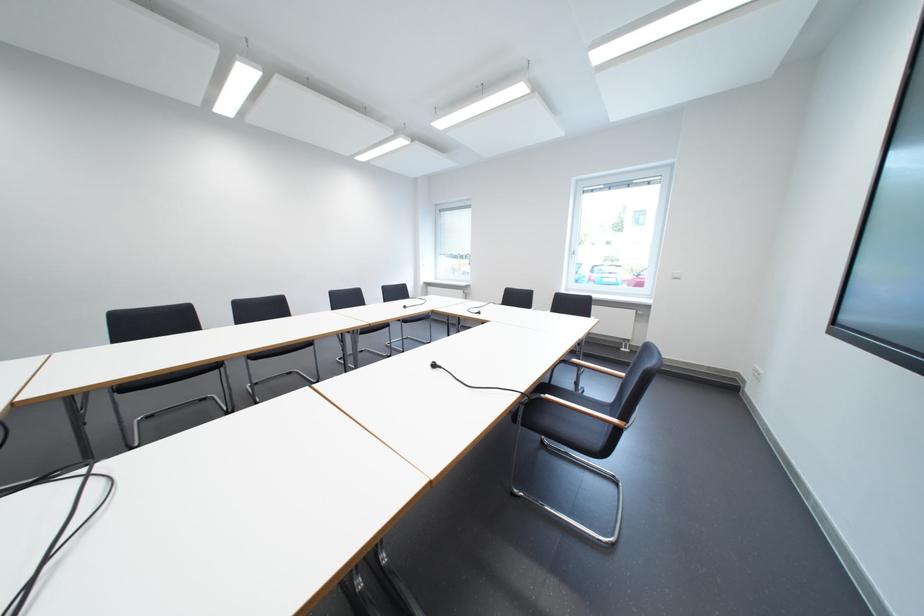
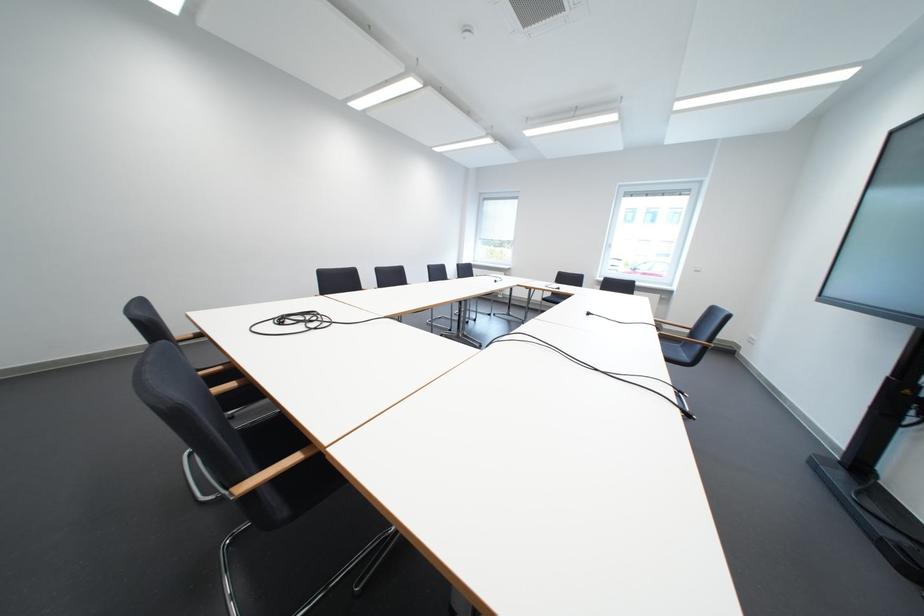
Which direction would the cameraman need to move to produce the second image?

The cameraman moved toward left, backward.